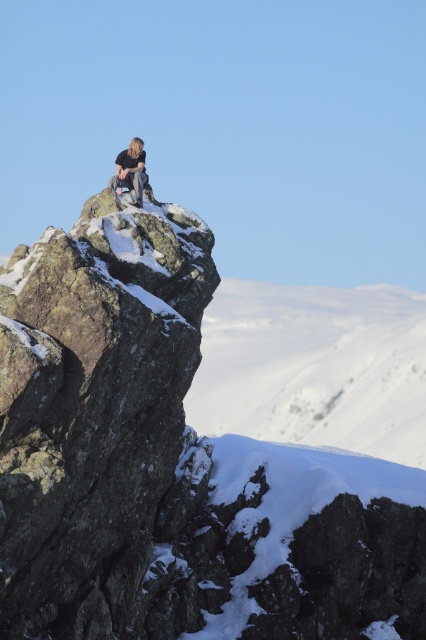
Question: Is rocky cliff at upper center positioned at the back of light brown hair at upper center?

Choices:
 (A) no
 (B) yes

Answer: (A)

Question: Which point appears farthest from the camera in this image?

Choices:
 (A) (135, 176)
 (B) (290, 468)

Answer: (B)

Question: Is rocky cliff at upper center positioned in front of light brown hair at upper center?

Choices:
 (A) yes
 (B) no

Answer: (A)

Question: Which point is closer to the camera?

Choices:
 (A) (0, 620)
 (B) (135, 172)

Answer: (A)

Question: Is rocky cliff at upper center to the left of light brown hair at upper center from the viewer's perspective?

Choices:
 (A) yes
 (B) no

Answer: (B)